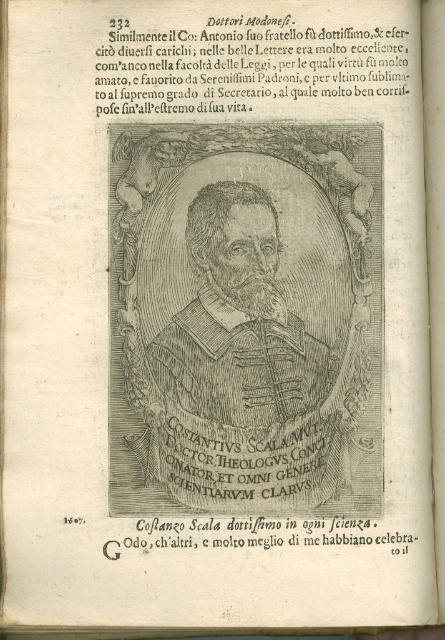
Looking at this image, you are a book conservator examining this historical page. You need to determine if the black engraving portrait at center can fit horizontally within the black paper at lower center without overlapping its edges. Based on their widths, can it fit?

The black engraving portrait at center has a width less than that of the black paper at lower center, so it can fit horizontally within the black paper at lower center without overlapping its edges.

Looking at the page from the old book, where is the black engraving portrait at center located relative to the black paper text at upper center?

The black engraving portrait at center is to the left of the black paper text at upper center.

You are an archivist examining this historical page. You need to determine which element takes up more space visually between the black engraving portrait at center and the black paper text at upper center. Which one is larger?

The black engraving portrait at center is larger in size than the black paper text at upper center, so the portrait takes up more space visually.